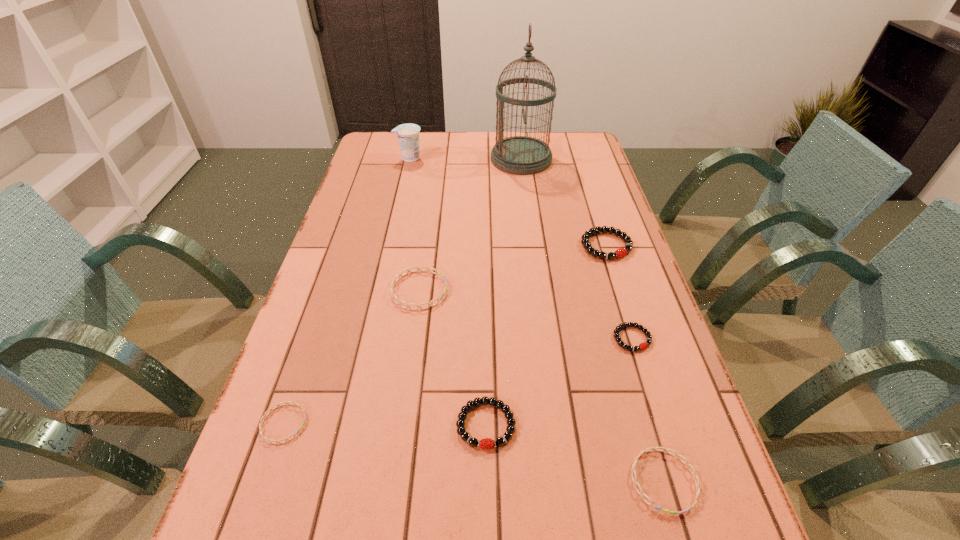
This screenshot has width=960, height=540. I want to click on vacant area located on the surface of the fifth bracelet from right to left showing star-shaped elements, so click(x=588, y=290).

Locate an element on the screen. vacant space located 0.340m on the right of the second smallest black bracelet is located at coordinates (684, 424).

The width and height of the screenshot is (960, 540). I want to click on vacant space located on the left of the fourth nearest bracelet, so click(559, 339).

At what (x,y) coordinates should I click in order to perform the action: click on vacant space located on the surface of the leftmost bracelet showing star-shaped elements. Please return your answer as a coordinate pair (x, y). Looking at the image, I should click on (415, 423).

Locate an element on the screen. The image size is (960, 540). birdcage situated at the far edge is located at coordinates (521, 155).

Locate an element on the screen. Image resolution: width=960 pixels, height=540 pixels. yogurt at the far edge is located at coordinates (408, 134).

Find the location of a particular element. yogurt that is at the left edge is located at coordinates (408, 134).

Where is `bracelet located at the left edge`? Image resolution: width=960 pixels, height=540 pixels. bracelet located at the left edge is located at coordinates (289, 402).

The height and width of the screenshot is (540, 960). Find the location of `object present at the far left corner`. object present at the far left corner is located at coordinates (408, 134).

Locate an element on the screen. vacant region at the far edge of the desktop is located at coordinates coord(509,132).